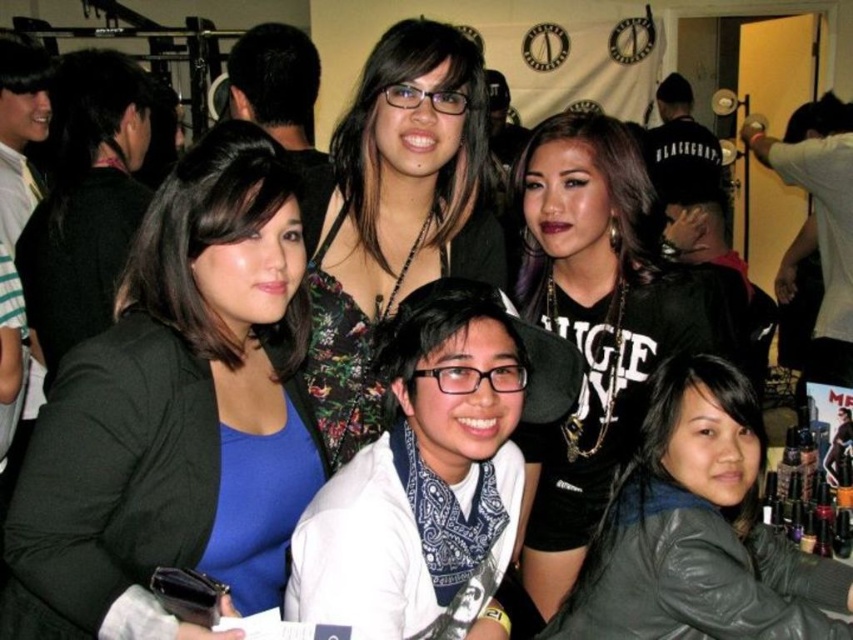
Question: Among these objects, which one is nearest to the camera?

Choices:
 (A) leather jacket at lower right
 (B) floral fabric dress at center

Answer: (A)

Question: Which of these objects is positioned farthest from the leather jacket at lower right?

Choices:
 (A) matte black blazer at left
 (B) floral fabric dress at center
 (C) black leather jacket at center

Answer: (A)

Question: Is matte black blazer at left bigger than leather jacket at lower right?

Choices:
 (A) yes
 (B) no

Answer: (A)

Question: Which point is farther to the camera?

Choices:
 (A) (660, 564)
 (B) (173, 276)
 (C) (393, 172)
 (D) (584, 397)

Answer: (D)

Question: Can you confirm if matte black blazer at left is positioned to the left of black leather jacket at center?

Choices:
 (A) no
 (B) yes

Answer: (B)

Question: Does black leather jacket at center have a larger size compared to floral fabric dress at center?

Choices:
 (A) yes
 (B) no

Answer: (A)